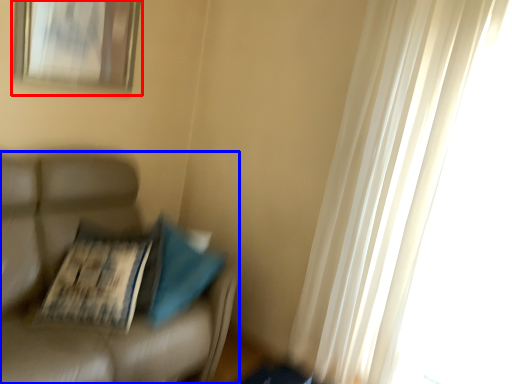
Question: Which point is closer to the camera, picture frame (highlighted by a red box) or furniture (highlighted by a blue box)?

Choices:
 (A) picture frame
 (B) furniture

Answer: (B)